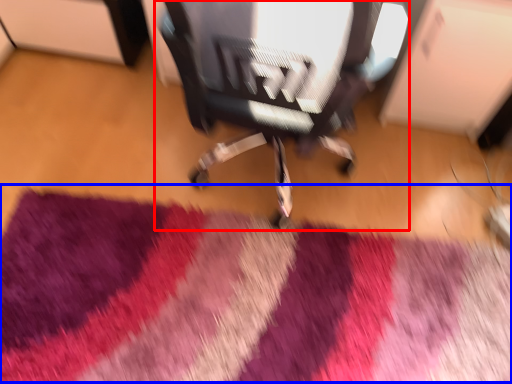
Question: Which object appears farthest to the camera in this image, chair (highlighted by a red box) or mat (highlighted by a blue box)?

Choices:
 (A) chair
 (B) mat

Answer: (B)